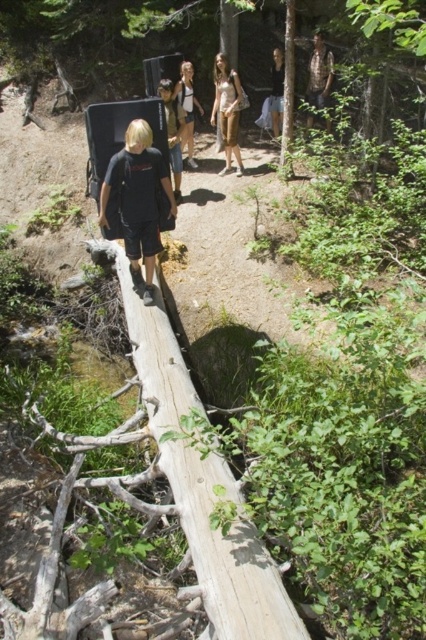
Question: Is black matte shirt at center to the right of light brown wooden log at center from the viewer's perspective?

Choices:
 (A) yes
 (B) no

Answer: (B)

Question: Where is black matte shirt at center located in relation to light brown fabric dress at center in the image?

Choices:
 (A) below
 (B) above

Answer: (A)

Question: Among these objects, which one is farthest from the camera?

Choices:
 (A) light brown fabric dress at center
 (B) matte white tank top at center

Answer: (A)

Question: Is black cotton shirt at center further to camera compared to matte white tank top at center?

Choices:
 (A) no
 (B) yes

Answer: (A)

Question: Which point appears closest to the camera in this image?

Choices:
 (A) (219, 56)
 (B) (325, 67)

Answer: (A)

Question: Which point is closer to the camera?

Choices:
 (A) black cotton shirt at center
 (B) matte white tank top at center

Answer: (A)